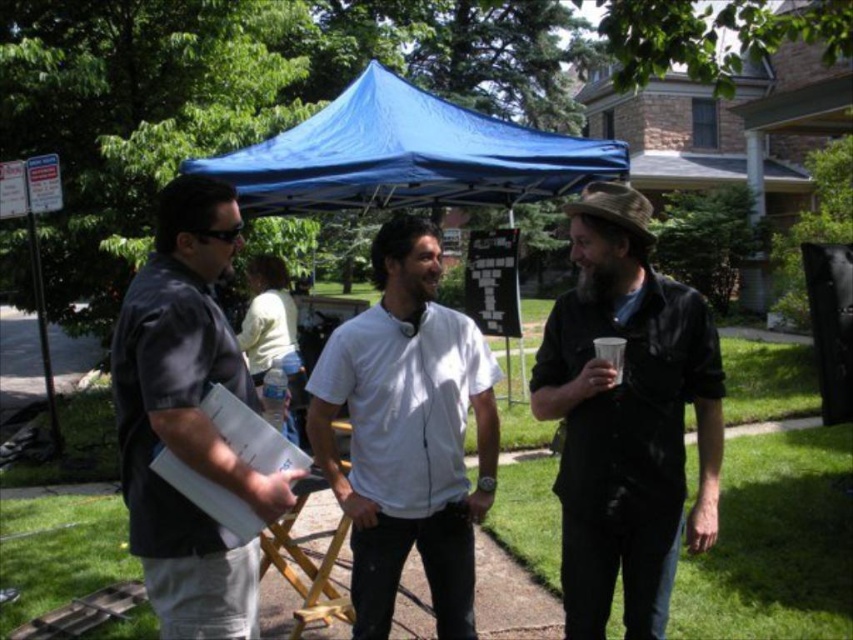
Consider the image. You are organizing a photo shoot and need to ensure that all participants are visible in the frame. Given that the white matte shirt at center and the dark gray shirt at left are part of the group, which participant should you focus on to ensure the entire group is in the shot?

The white matte shirt at center is bigger than the dark gray shirt at left, so focusing on the white matte shirt at center would help ensure the entire group is visible in the frame since it takes up more space.